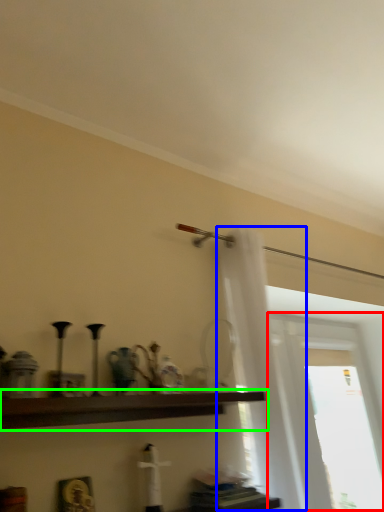
Question: Estimate the real-world distances between objects in this image. Which object is closer to window (highlighted by a red box), shower curtain (highlighted by a blue box) or shelf (highlighted by a green box)?

Choices:
 (A) shower curtain
 (B) shelf

Answer: (A)